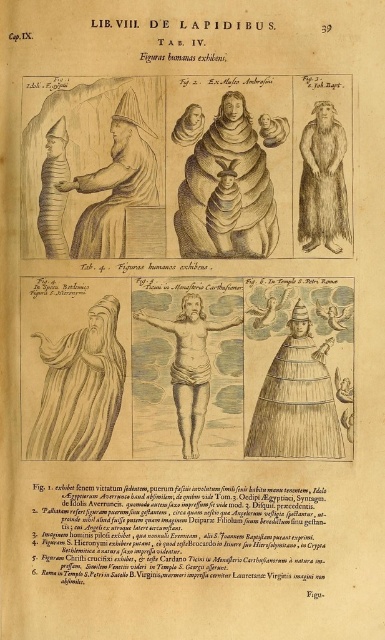
Question: Among these points, which one is nearest to the camera?

Choices:
 (A) (172, 362)
 (B) (348, 211)
 (C) (112, 339)

Answer: (B)

Question: Can you confirm if smooth white robe at left is wider than brown fur robe at right?

Choices:
 (A) no
 (B) yes

Answer: (B)

Question: Does brown textured robe at center have a lesser width compared to wooden statue at left?

Choices:
 (A) no
 (B) yes

Answer: (A)

Question: Estimate the real-world distances between objects in this image. Which object is closer to the brown fur robe at right?

Choices:
 (A) smooth white robe at left
 (B) golden textured cone at center

Answer: (B)

Question: Which point is closer to the camera?

Choices:
 (A) smooth white robe at left
 (B) brown fur robe at right

Answer: (B)

Question: Where is golden textured cone at center located in relation to wooden statue at left in the image?

Choices:
 (A) left
 (B) right

Answer: (B)